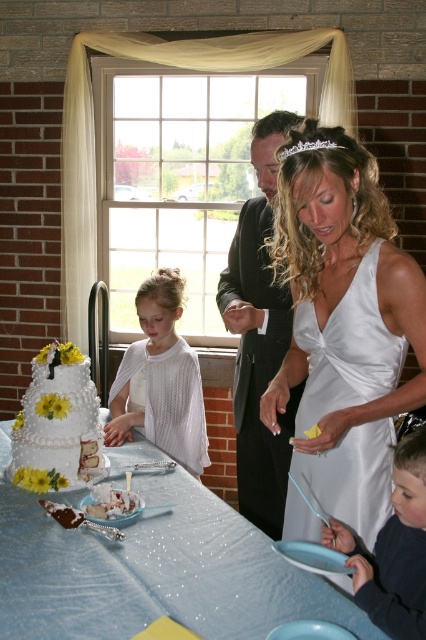
Who is higher up, white glittery tablecloth at center or white textured cake at center?

white textured cake at center is higher up.

Is white glittery tablecloth at center above white textured cake at center?

Actually, white glittery tablecloth at center is below white textured cake at center.

This screenshot has width=426, height=640. I want to click on white glittery tablecloth at center, so click(154, 570).

At what (x,y) coordinates should I click in order to perform the action: click on white glittery tablecloth at center. Please return your answer as a coordinate pair (x, y). This screenshot has height=640, width=426. Looking at the image, I should click on (154, 570).

Who is taller, black satin suit at center or white textured cake at center?

Standing taller between the two is black satin suit at center.

Who is positioned more to the left, black satin suit at center or white textured cake at center?

white textured cake at center is more to the left.

Identify the location of black satin suit at center. (259, 337).

Where is `black satin suit at center`? black satin suit at center is located at coordinates (259, 337).

What do you see at coordinates (154, 570) in the screenshot?
I see `white glittery tablecloth at center` at bounding box center [154, 570].

Is white glittery tablecloth at center below smooth blue shirt at lower right?

Correct, white glittery tablecloth at center is located below smooth blue shirt at lower right.

This screenshot has width=426, height=640. What do you see at coordinates (154, 570) in the screenshot?
I see `white glittery tablecloth at center` at bounding box center [154, 570].

Locate an element on the screen. The width and height of the screenshot is (426, 640). white glittery tablecloth at center is located at coordinates (154, 570).